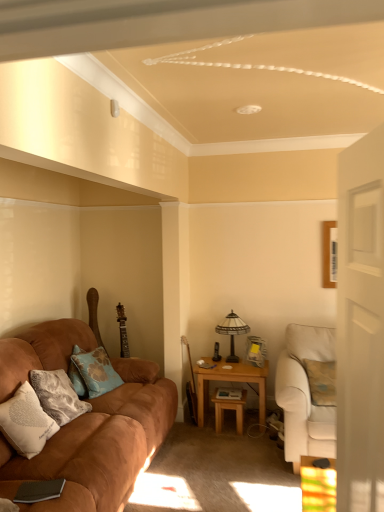
Question: From a real-world perspective, is stained glass lampshade at center-right over wooden table at center, acting as the 2th table starting from the right?

Choices:
 (A) yes
 (B) no

Answer: (A)

Question: Is stained glass lampshade at center-right bigger than wooden table at center, placed as the first table when sorted from left to right?

Choices:
 (A) yes
 (B) no

Answer: (A)

Question: Does stained glass lampshade at center-right lie in front of wooden table at center, acting as the 2th table starting from the right?

Choices:
 (A) yes
 (B) no

Answer: (B)

Question: Is wooden table at center, placed as the first table when sorted from left to right, located within stained glass lampshade at center-right?

Choices:
 (A) yes
 (B) no

Answer: (B)

Question: From a real-world perspective, is stained glass lampshade at center-right located beneath wooden table at center, placed as the first table when sorted from left to right?

Choices:
 (A) no
 (B) yes

Answer: (A)

Question: Does stained glass lampshade at center-right come behind wooden table at center, acting as the 2th table starting from the right?

Choices:
 (A) no
 (B) yes

Answer: (B)

Question: Considering the relative sizes of suede brown couch at left, arranged as the first studio couch when viewed from the left, and white soft pillow at lower left, arranged as the first pillow when viewed from the front, in the image provided, is suede brown couch at left, arranged as the first studio couch when viewed from the left, wider than white soft pillow at lower left, arranged as the first pillow when viewed from the front,?

Choices:
 (A) yes
 (B) no

Answer: (A)

Question: Considering the relative positions of suede brown couch at left, the second studio couch from the right, and white soft pillow at lower left, arranged as the first pillow when viewed from the front, in the image provided, is suede brown couch at left, the second studio couch from the right, behind white soft pillow at lower left, arranged as the first pillow when viewed from the front,?

Choices:
 (A) yes
 (B) no

Answer: (B)

Question: Considering the relative sizes of suede brown couch at left, the second studio couch from the right, and white soft pillow at lower left, the 2th pillow from the back, in the image provided, is suede brown couch at left, the second studio couch from the right, taller than white soft pillow at lower left, the 2th pillow from the back,?

Choices:
 (A) yes
 (B) no

Answer: (A)

Question: Is suede brown couch at left, the second studio couch from the right, bigger than white soft pillow at lower left, arranged as the first pillow when viewed from the front?

Choices:
 (A) no
 (B) yes

Answer: (B)

Question: Considering the relative sizes of suede brown couch at left, the second studio couch from the right, and white soft pillow at lower left, arranged as the first pillow when viewed from the front, in the image provided, is suede brown couch at left, the second studio couch from the right, shorter than white soft pillow at lower left, arranged as the first pillow when viewed from the front,?

Choices:
 (A) yes
 (B) no

Answer: (B)

Question: Is suede brown couch at left, arranged as the first studio couch when viewed from the left, not within white soft pillow at lower left, arranged as the first pillow when viewed from the front?

Choices:
 (A) no
 (B) yes

Answer: (B)

Question: Can you confirm if blue fabric pillow at left, which is counted as the second pillow, starting from the front, is wider than stained glass lampshade at center-right?

Choices:
 (A) no
 (B) yes

Answer: (B)